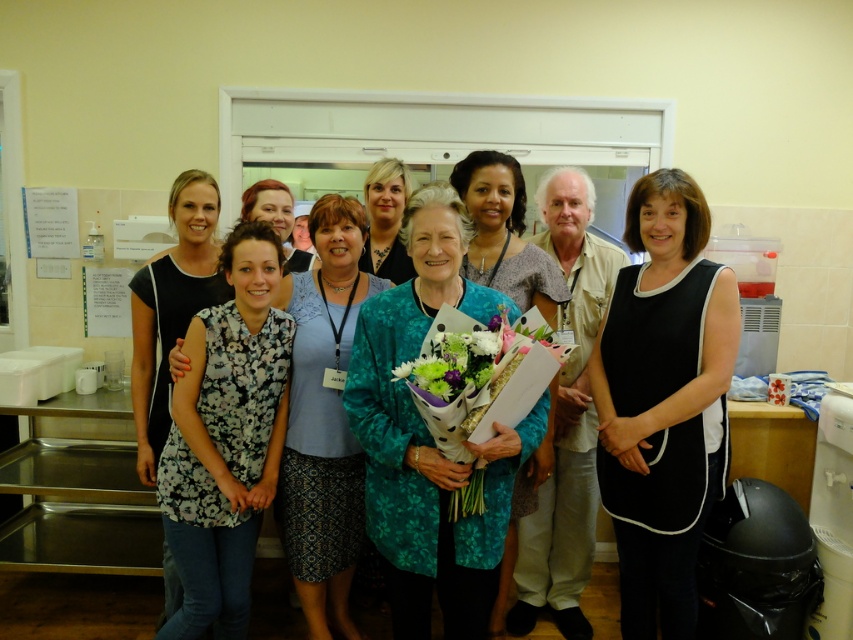
Does floral fabric blouse at center lie in front of black floral dress at center?

Yes, floral fabric blouse at center is in front of black floral dress at center.

Between point (169, 508) and point (186, 300), which one is positioned behind?

The point (186, 300) is behind.

This screenshot has width=853, height=640. I want to click on floral fabric blouse at center, so click(x=225, y=438).

Can you confirm if black satin dress at center is smaller than teal floral dress at center?

No, black satin dress at center is not smaller than teal floral dress at center.

Is point (669, 422) farther from camera compared to point (457, 184)?

No, (669, 422) is closer to viewer.

In order to click on black satin dress at center in this screenshot , I will do `click(663, 401)`.

Find the location of a particular element. floral fabric blouse at center is located at coordinates (225, 438).

Measure the distance between point [219,577] and camera.

7.22 feet

Which is in front, point (241, 609) or point (389, 172)?

Point (241, 609) is in front.

This screenshot has height=640, width=853. I want to click on floral fabric blouse at center, so click(225, 438).